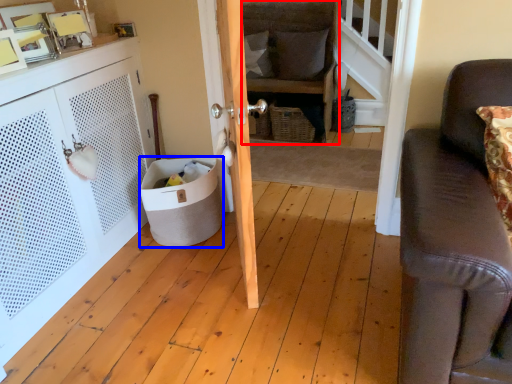
Question: Which of the following is the farthest to the observer, chair (highlighted by a red box) or trash bin/can (highlighted by a blue box)?

Choices:
 (A) chair
 (B) trash bin/can

Answer: (A)